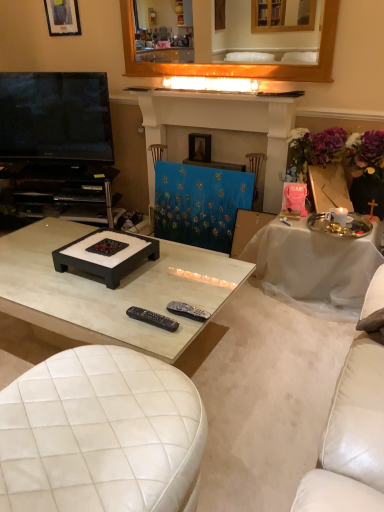
I want to click on vacant area situated to the left side of black plastic remote at center, marked as the 1th remote control in a right-to-left arrangement, so click(x=132, y=321).